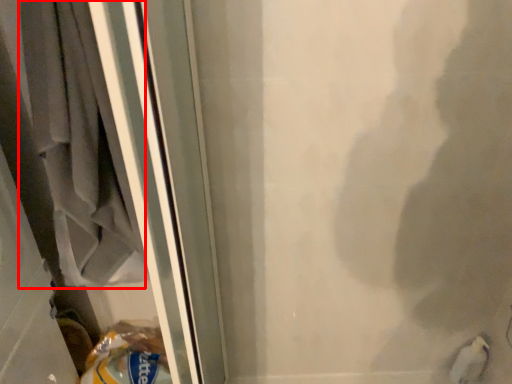
Question: From the image, what is the correct spatial relationship of laundry (annotated by the red box) in relation to animal?

Choices:
 (A) right
 (B) left

Answer: (B)